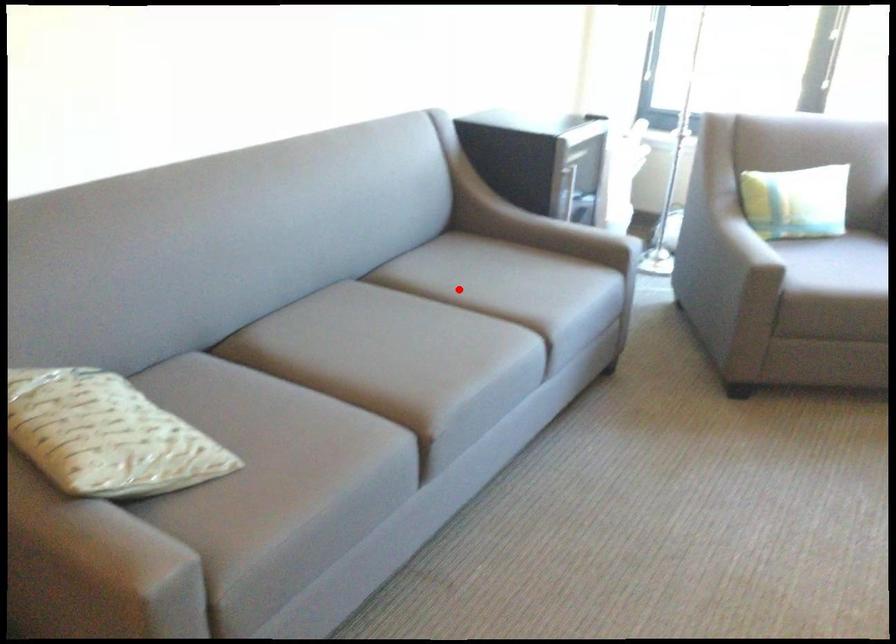
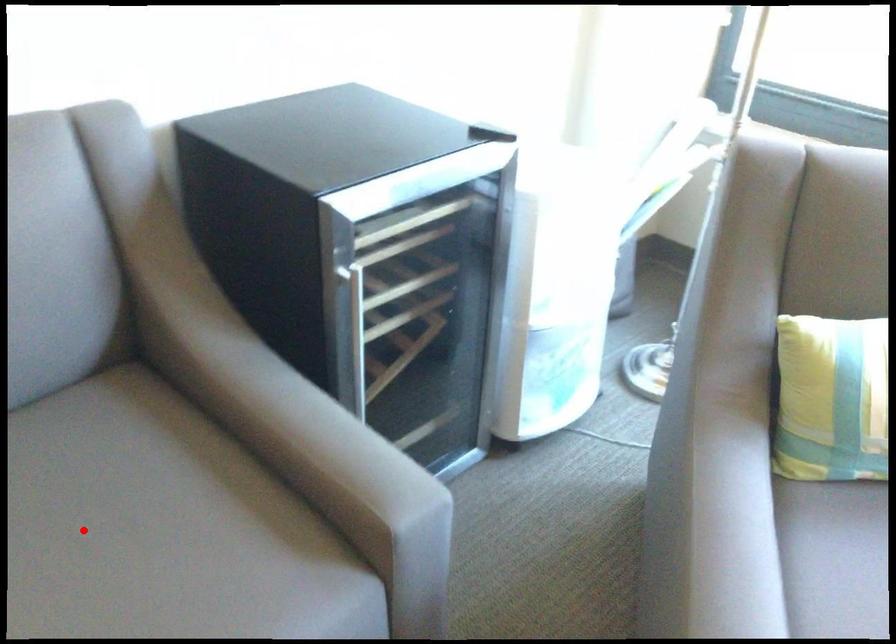
I am providing you with two images of the same scene from different viewpoints. A red point is marked on the first image and another point is marked on the second image. Is the marked point in image1 the same physical position as the marked point in image2?

Yes